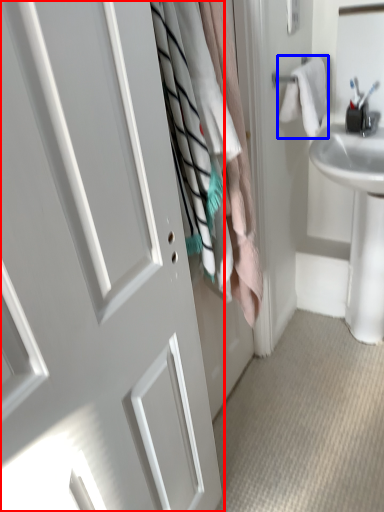
Question: Among these objects, which one is farthest to the camera, door (highlighted by a red box) or bath towel (highlighted by a blue box)?

Choices:
 (A) door
 (B) bath towel

Answer: (B)